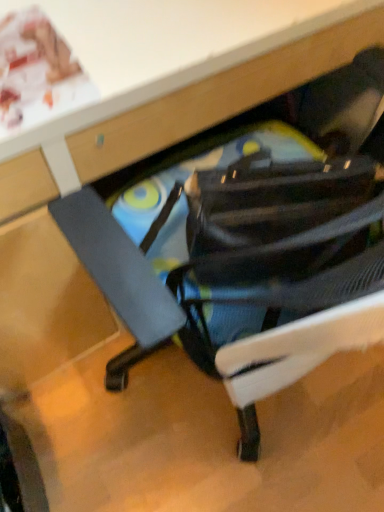
What do you see at coordinates (249, 248) in the screenshot?
I see `matte black chair at center` at bounding box center [249, 248].

Locate an element on the screen. matte black chair at center is located at coordinates (249, 248).

This screenshot has width=384, height=512. What are the coordinates of `matte black chair at center` in the screenshot? It's located at (249, 248).